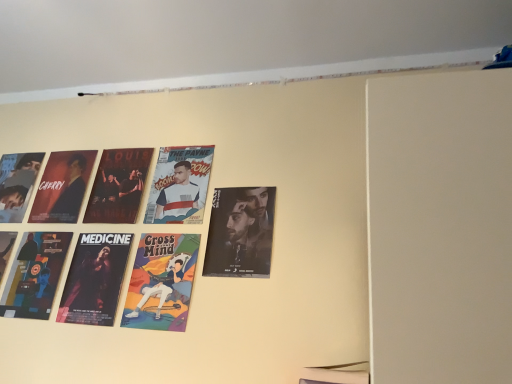
Question: Considering the positions of point (220, 268) and point (160, 210), is point (220, 268) closer or farther from the camera than point (160, 210)?

Choices:
 (A) closer
 (B) farther

Answer: (A)

Question: Looking at the image, does matte black poster at center, the 3th poster from the left, seem bigger or smaller compared to white glossy poster at center, the 1th person viewed from the right?

Choices:
 (A) small
 (B) big

Answer: (B)

Question: Estimate the real-world distances between objects in this image. Which object is farther from the white glossy poster at center, the third person in the left-to-right sequence?

Choices:
 (A) matte black poster at center, acting as the first poster starting from the right
 (B) matte black poster at left, the third person positioned from the right
 (C) cartoon character poster at center, the second person from the right
 (D) matte black poster at lower left, which appears as the first poster when viewed from the left
 (E) matte black poster at center left, marked as the second poster in a right-to-left arrangement

Answer: (D)

Question: Based on their relative distances, which object is nearer to the matte black poster at lower left, which appears as the first poster when viewed from the left?

Choices:
 (A) matte black poster at center, the 3th poster from the left
 (B) matte black poster at left, the third person positioned from the right
 (C) white glossy poster at center, the third person in the left-to-right sequence
 (D) cartoon character poster at center, which appears as the 2th person when viewed from the left
 (E) matte black poster at center left, which ranks as the second poster in left-to-right order

Answer: (B)